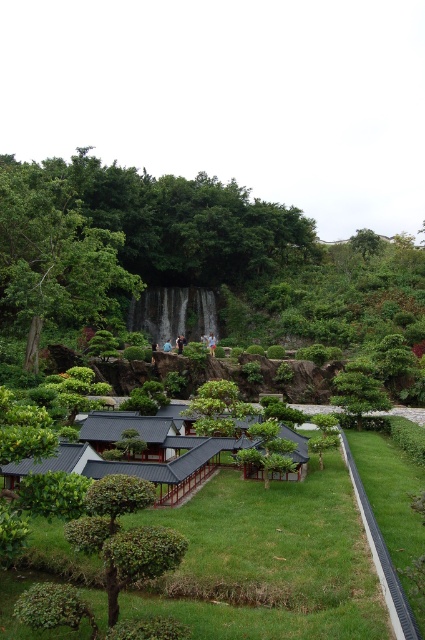
Is green leafy tree at left further to camera compared to green leafy tree at upper center?

No.

At what (x,y) coordinates should I click in order to perform the action: click on green leafy tree at left. Please return your answer as a coordinate pair (x, y). The width and height of the screenshot is (425, 640). Looking at the image, I should click on (53, 256).

Measure the distance between point (17, 161) and camera.

A distance of 183.77 meters exists between point (17, 161) and camera.

The height and width of the screenshot is (640, 425). I want to click on green leafy tree at left, so click(53, 256).